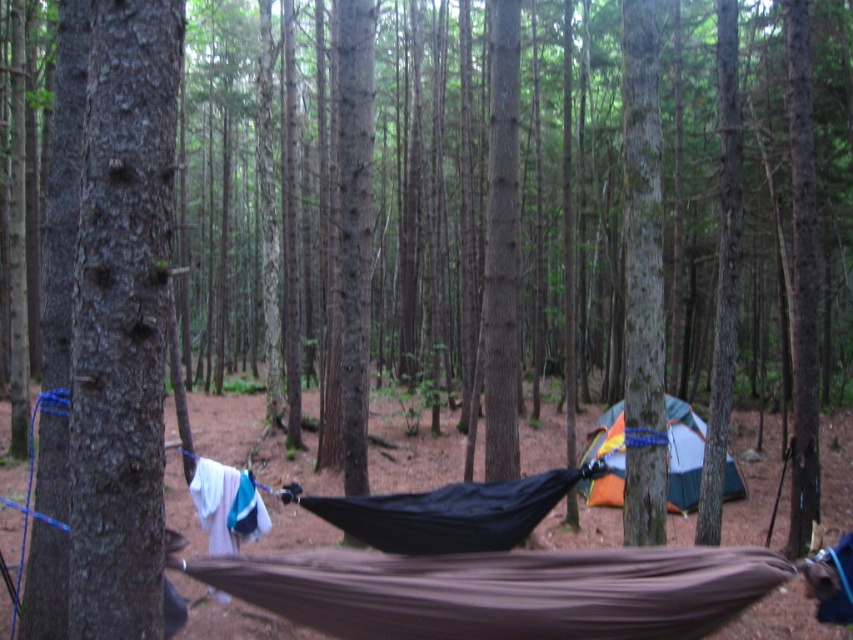
You are planning to set up a tent in the forest and notice the brown rough bark at left and the green canvas tent at center. Which object takes up more space in the image?

The green canvas tent at center occupies more space than the brown rough bark at left.

You are planning to hang a small birdhouse in this forest scene. The birdhouse is 30 cm tall. You want to place it on the brown rough bark at left or the green canvas tent at center. Which object can accommodate the birdhouse without the birdhouse exceeding its height?

The brown rough bark at left has a greater height compared to the green canvas tent at center, so the birdhouse can be placed on the brown rough bark at left without exceeding its height.